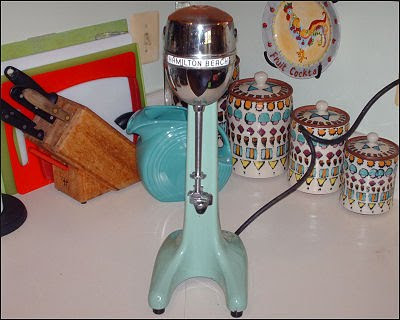
This screenshot has height=320, width=400. Find the location of `block for knives`. block for knives is located at coordinates (87, 156).